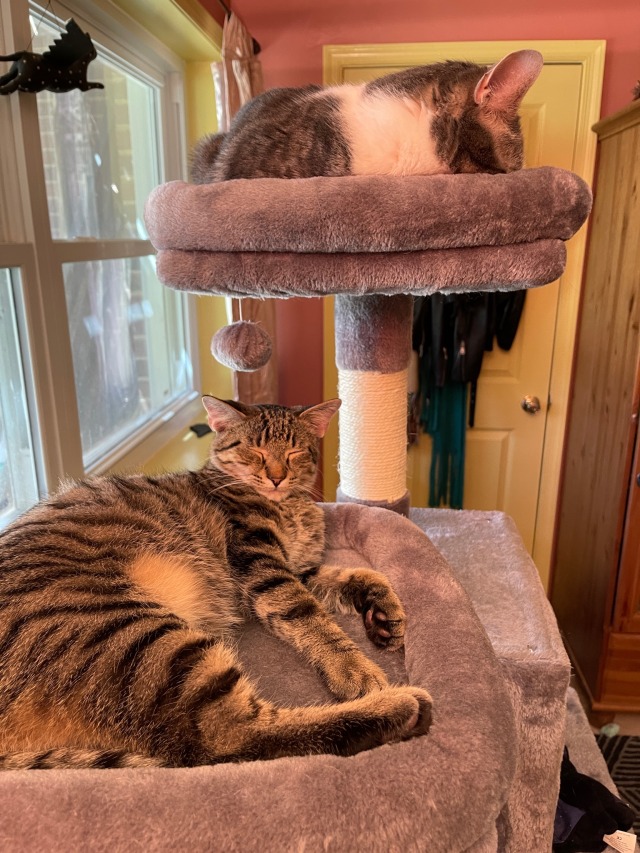
Identify the location of wall. This screenshot has height=853, width=640. coord(294,33).